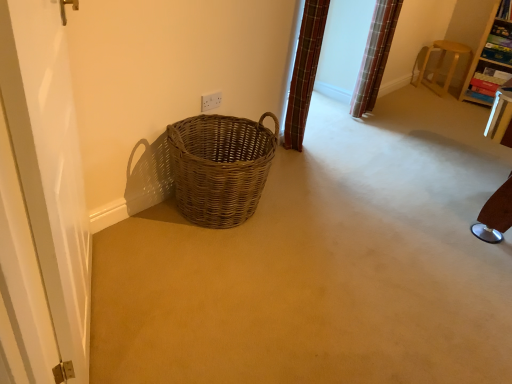
At what (x,y) coordinates should I click in order to perform the action: click on vacant area that is in front of plaid fabric curtain at upper right, the 2th curtain when ordered from right to left. Please return your answer as a coordinate pair (x, y). Looking at the image, I should click on point(297,154).